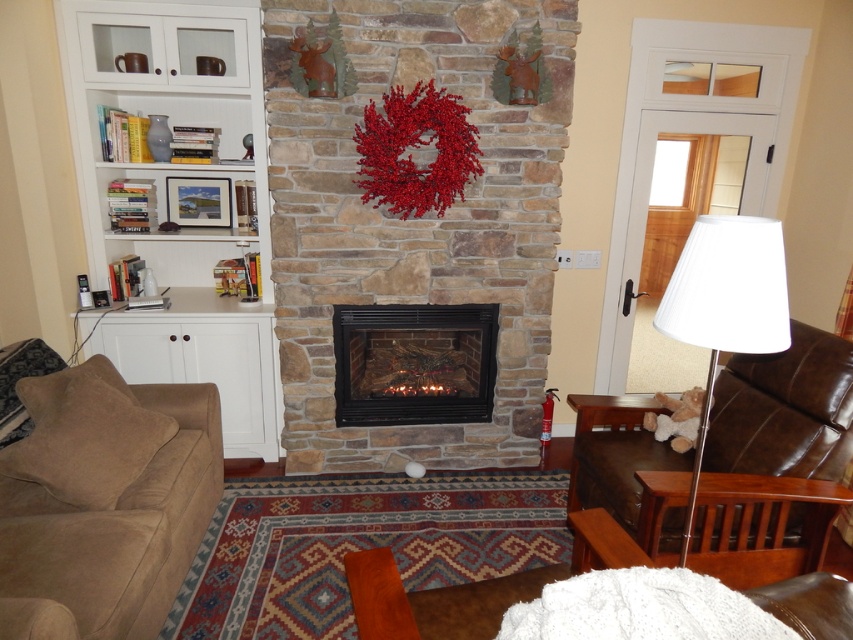
Based on the photo, you are planning to place a tall floor lamp in the living room. The lamp is 1.8 meters in height. Given the white wood bookshelf at left and the black glass fireplace at center, which object is more suitable to place the lamp next to based on their height?

The white wood bookshelf at left is taller than the black glass fireplace at center, so placing the tall floor lamp next to the white wood bookshelf at left would be more suitable as it can accommodate the lamp without it appearing too disproportionate in comparison.

You are sitting in the brown leather armchair at right and want to place a book on the nearest shelf. Based on the scene description, where is the closest shelf located relative to the black glass fireplace at center?

The brown leather armchair at right is positioned under the black glass fireplace at center, so the closest shelf would be the one located to the left of the black glass fireplace at center, as described in the scene.

You are a guest standing in the living room and want to take a photo of the black glass fireplace at center. To avoid the white wood bookshelf at left blocking the view, where should you position yourself?

The white wood bookshelf at left is in front of the black glass fireplace at center, so to avoid blocking the view, you should move to the right side of the white wood bookshelf at left to take the photo.